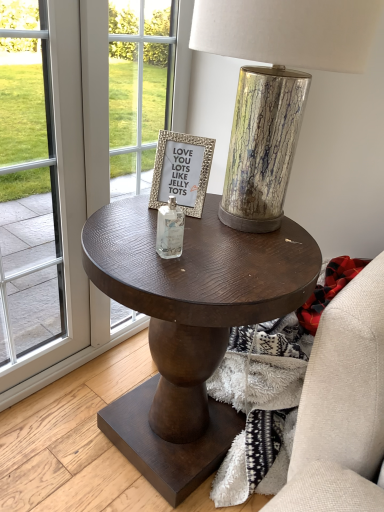
Question: Would you say clear glass bottle at center is inside or outside transparent glass screen door at left?

Choices:
 (A) inside
 (B) outside

Answer: (B)

Question: From the image's perspective, is clear glass bottle at center above or below transparent glass screen door at left?

Choices:
 (A) above
 (B) below

Answer: (A)

Question: Which of these objects is positioned farthest from the dark wood side table at center?

Choices:
 (A) gold textured frame at center
 (B) transparent glass screen door at left
 (C) clear glass bottle at center
 (D) metallic cracked glass table lamp at center

Answer: (B)

Question: Which is nearer to the transparent glass screen door at left?

Choices:
 (A) clear glass bottle at center
 (B) metallic cracked glass table lamp at center
 (C) gold textured frame at center
 (D) dark wood side table at center

Answer: (D)